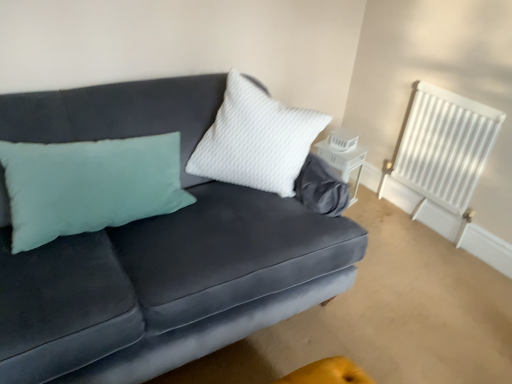
The height and width of the screenshot is (384, 512). I want to click on blank space situated above white painted metal radiator at upper right (from a real-world perspective), so click(456, 88).